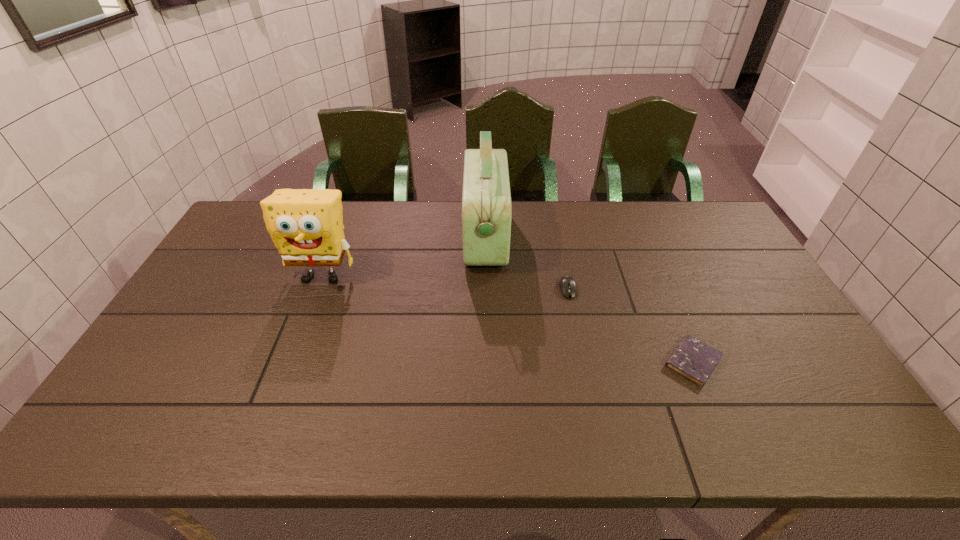
The image size is (960, 540). Identify the location of free area in between the radio receiver and the diary. (588, 299).

Where is `unoccupied position between the second object from right to left and the second object from left to right`? This screenshot has width=960, height=540. unoccupied position between the second object from right to left and the second object from left to right is located at coordinates (526, 262).

This screenshot has width=960, height=540. I want to click on free space between the third shortest object and the shortest object, so click(x=508, y=319).

I want to click on empty space that is in between the shortest object and the second tallest object, so click(508, 319).

Identify the location of vacant area that lies between the second object from right to left and the shortest object. This screenshot has width=960, height=540. (631, 325).

The image size is (960, 540). I want to click on vacant area that lies between the rightmost object and the third shortest object, so click(508, 319).

You are a GUI agent. You are given a task and a screenshot of the screen. Output one action in this format:
    pyautogui.click(x=<x>, y=<y>)
    Task: Click on the free space between the rightmost object and the leftmost object
    The image size is (960, 540).
    Given the screenshot: What is the action you would take?
    pyautogui.click(x=508, y=319)

In order to click on empty space that is in between the third object from left to right and the leftmost object in this screenshot , I will do click(x=445, y=282).

Select which object is the second closest to the nearest object. Please provide its 2D coordinates. Your answer should be formatted as a tuple, i.e. [(x, y)], where the tuple contains the x and y coordinates of a point satisfying the conditions above.

[(486, 214)]

You are a GUI agent. You are given a task and a screenshot of the screen. Output one action in this format:
    pyautogui.click(x=<x>, y=<y>)
    Task: Click on the object that is the third closest to the third object from left to right
    This screenshot has height=540, width=960.
    Given the screenshot: What is the action you would take?
    pyautogui.click(x=306, y=225)